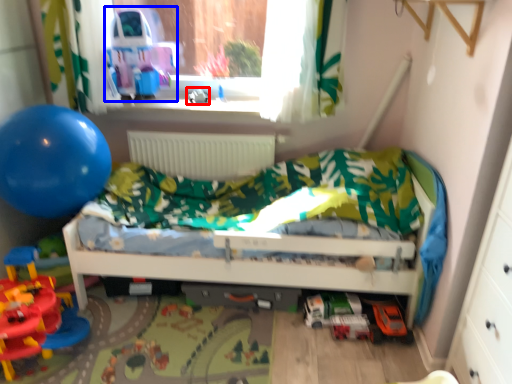
Question: Which object appears farthest to the camera in this image, toy (highlighted by a red box) or toy car (highlighted by a blue box)?

Choices:
 (A) toy
 (B) toy car

Answer: (A)